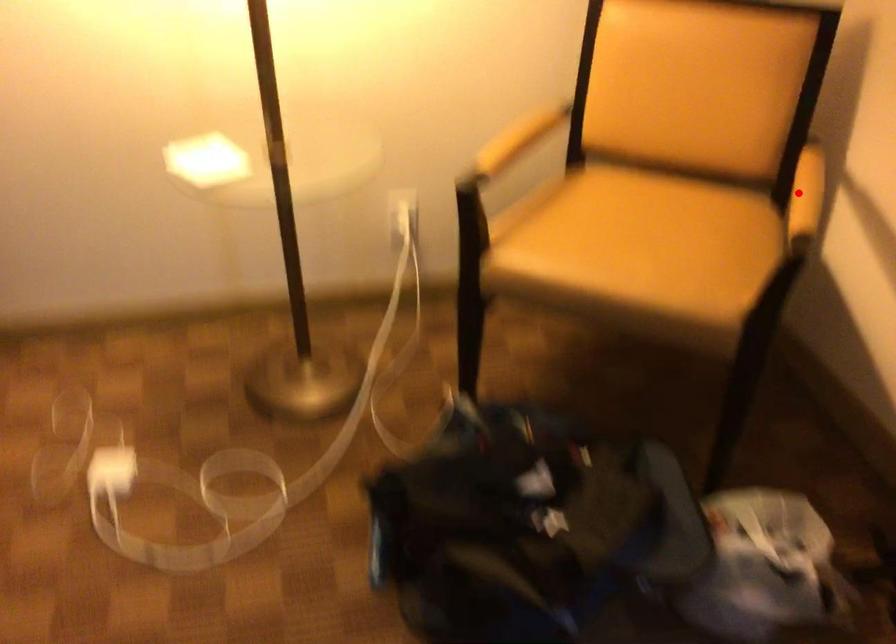
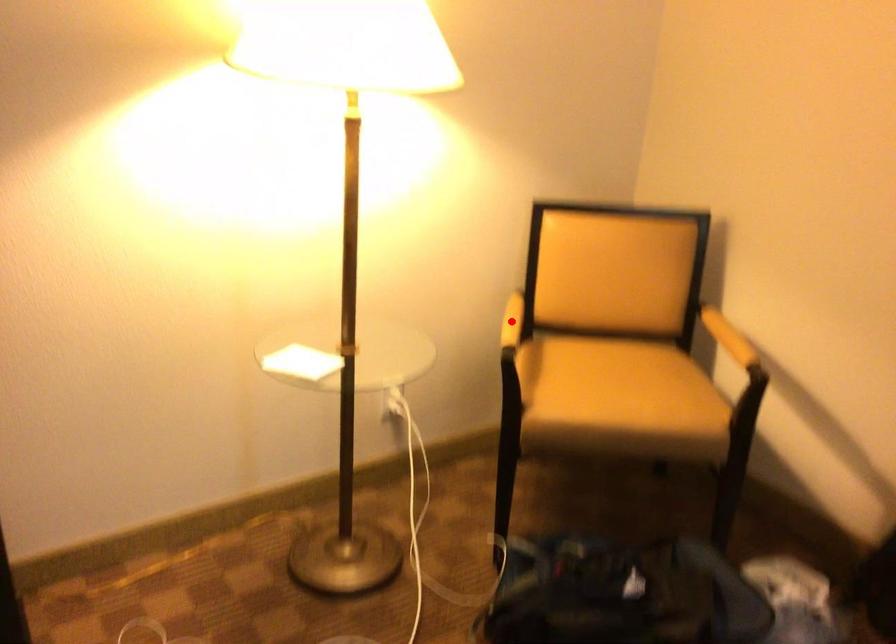
I am providing you with two images of the same scene from different viewpoints. A red point is marked on the first image and another point is marked on the second image. Is the marked point in image1 the same physical position as the marked point in image2?

No